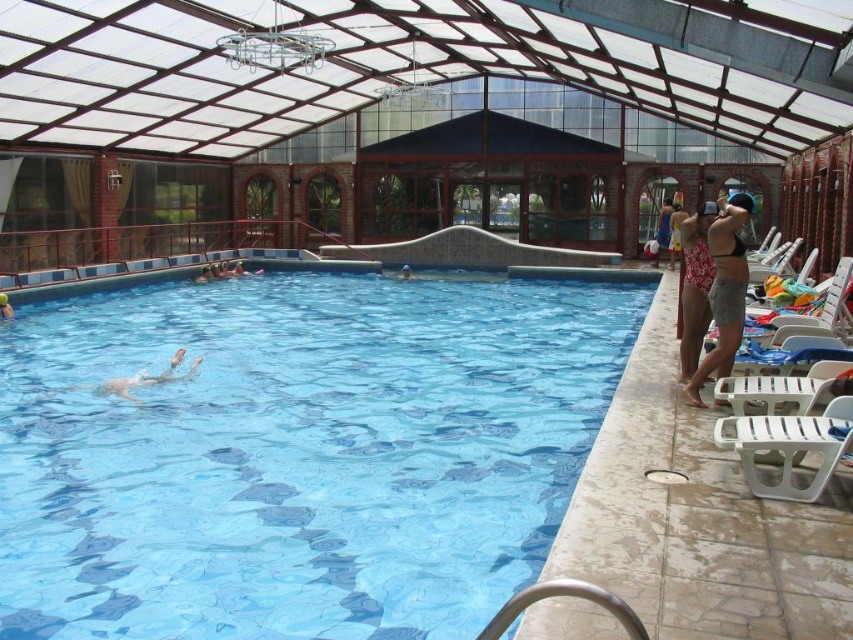
Question: Does blue glossy water at center appear on the right side of white swimsuit at right?

Choices:
 (A) yes
 (B) no

Answer: (B)

Question: Can you confirm if matte blue swimsuit at right is smaller than smooth skin person at center?

Choices:
 (A) yes
 (B) no

Answer: (B)

Question: Which point is closer to the camera?

Choices:
 (A) (117, 392)
 (B) (12, 312)
 (C) (740, 236)

Answer: (C)

Question: Which object is positioned closest to the white swimsuit at right?

Choices:
 (A) matte blue swimsuit at right
 (B) smooth skin person at center
 (C) smooth skin person at upper left
 (D) smooth skin swimmer at lower left

Answer: (D)

Question: Is white swimsuit at right below matte blue swimsuit at right?

Choices:
 (A) yes
 (B) no

Answer: (A)

Question: Which object is farther from the camera taking this photo?

Choices:
 (A) smooth skin person at center
 (B) matte black bikini top at right

Answer: (A)